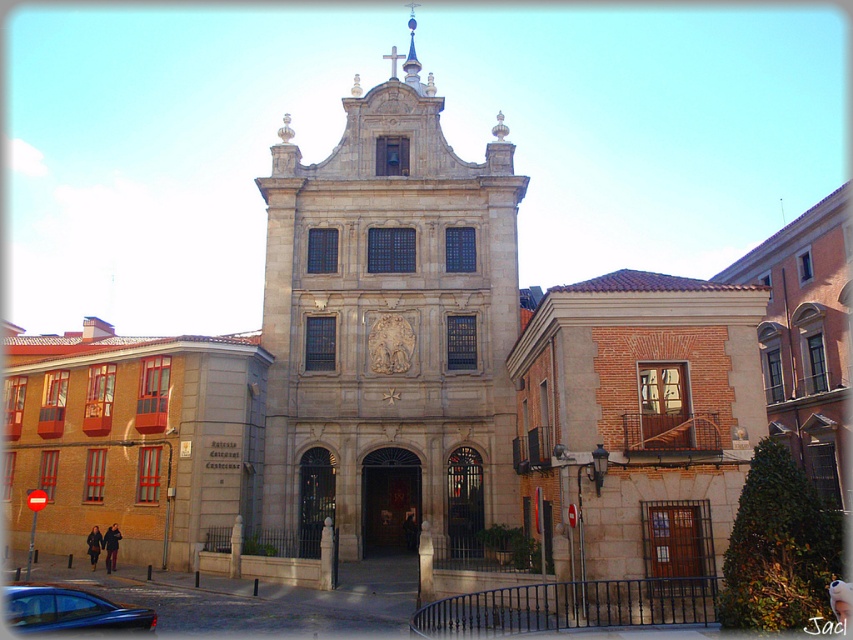
You are standing in front of the historic building and want to take a photo that includes both the stone church at center and the shiny black car at lower left. Which object should you position closer to the bottom of your camera frame?

The shiny black car at lower left should be positioned closer to the bottom of the camera frame because it is shorter than the stone church at center.